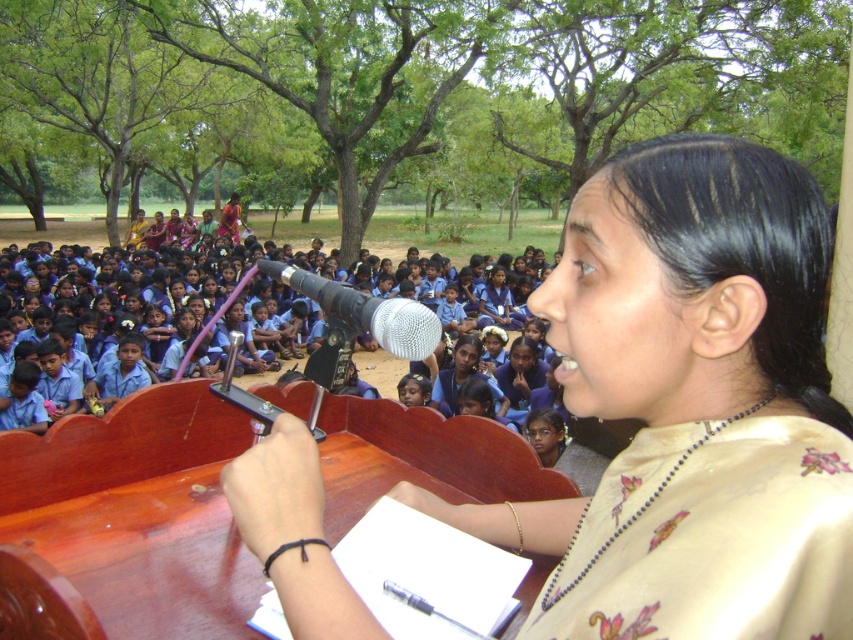
You are a photographer standing at the back of the crowd. You want to take a photo of the silver metallic microphone at center without the silk sari at center blocking it. Is this possible?

The silk sari at center is closer to the viewer than the silver metallic microphone at center, so the silk sari at center would block the view of the silver metallic microphone at center. Therefore, it is not possible to take a photo of the silver metallic microphone at center without the silk sari at center blocking it.

You are a photographer taking a picture of the speaker and the children. You need to ensure both the silk sari at center and the silver metallic microphone at center are clearly visible in the frame. Based on their positions, which object should you focus on first to ensure both are in focus?

The silk sari at center is located below the silver metallic microphone at center. To ensure both are in focus, you should focus on the silver metallic microphone at center first since it is higher up and closer to the camera, allowing the silk sari at center to fall within the depth of field.